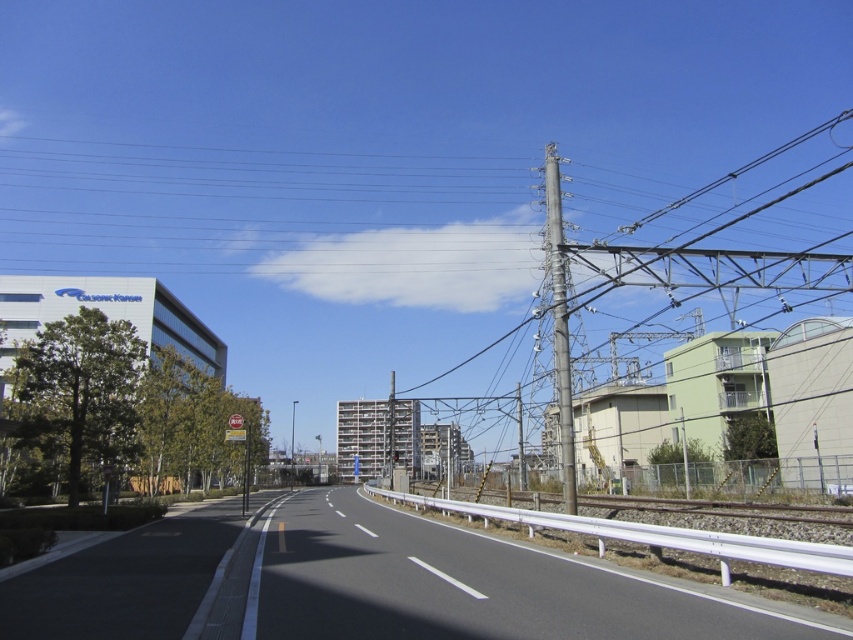
You are a driver approaching the black asphalt highway at center and the metallic gray pole at right. Which object will appear taller to you as you look ahead?

The metallic gray pole at right appears taller than the black asphalt highway at center because the highway is shorter than the pole.